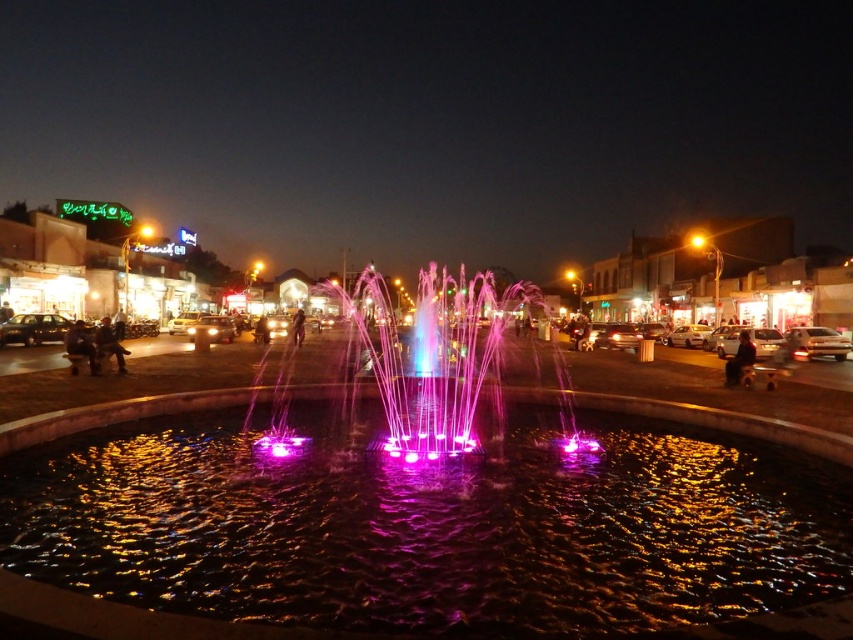
You are a photographer trying to capture the fountain in the image. You want to focus on the purple illuminated water at center and the multicolored illuminated water at center. Which one should you aim your camera at if you want to capture the taller water jet?

The multicolored illuminated water at center is taller than the purple illuminated water at center, so you should aim your camera at the multicolored illuminated water at center to capture the taller water jet.

From the picture: You are a photographer trying to capture the purple illuminated water at center and the multicolored illuminated water at center in a single shot. Which one appears closer to the camera based on their positions?

The purple illuminated water at center appears closer to the camera because it is positioned under the multicolored illuminated water at center, indicating it is in front.